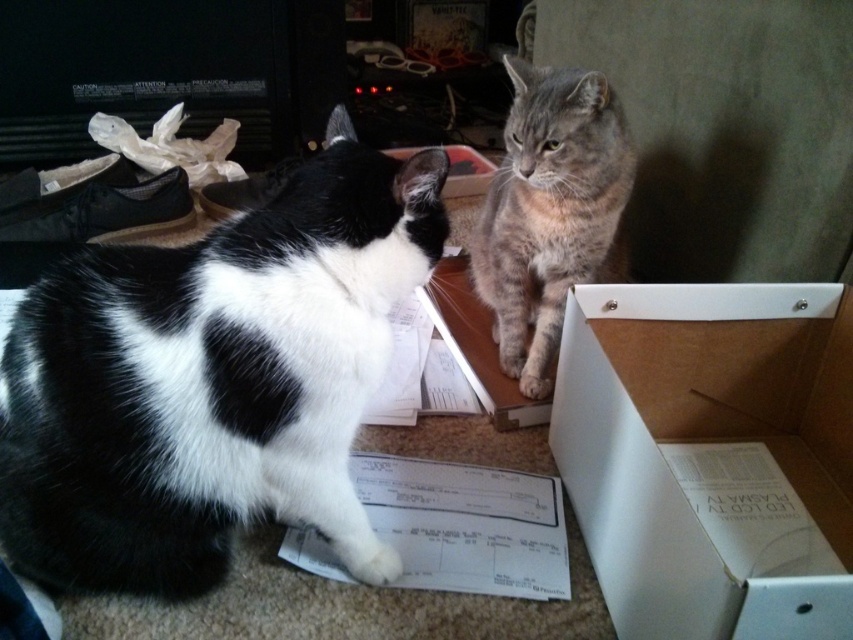
Which is more to the left, black and white fur cat at left or white cardboard box at lower right?

Positioned to the left is black and white fur cat at left.

From the picture: Who is more forward, (x=251, y=273) or (x=720, y=552)?

Positioned in front is point (x=251, y=273).

Which is in front, point (123, 362) or point (607, 416)?

Point (123, 362) is more forward.

Locate an element on the screen. This screenshot has width=853, height=640. black and white fur cat at left is located at coordinates (212, 380).

Does white cardboard box at lower right lie behind gray tabby cat at center?

No.

Which is behind, point (849, 605) or point (525, 310)?

The point (525, 310) is more distant.

Locate an element on the screen. white cardboard box at lower right is located at coordinates (711, 456).

What are the coordinates of `white cardboard box at lower right` in the screenshot? It's located at (711, 456).

Which is more to the right, black and white fur cat at left or gray tabby cat at center?

gray tabby cat at center

Which is behind, point (100, 417) or point (587, 173)?

Positioned behind is point (587, 173).

Is point (379, 570) farther from viewer compared to point (622, 132)?

No.

Locate an element on the screen. The image size is (853, 640). black and white fur cat at left is located at coordinates (212, 380).